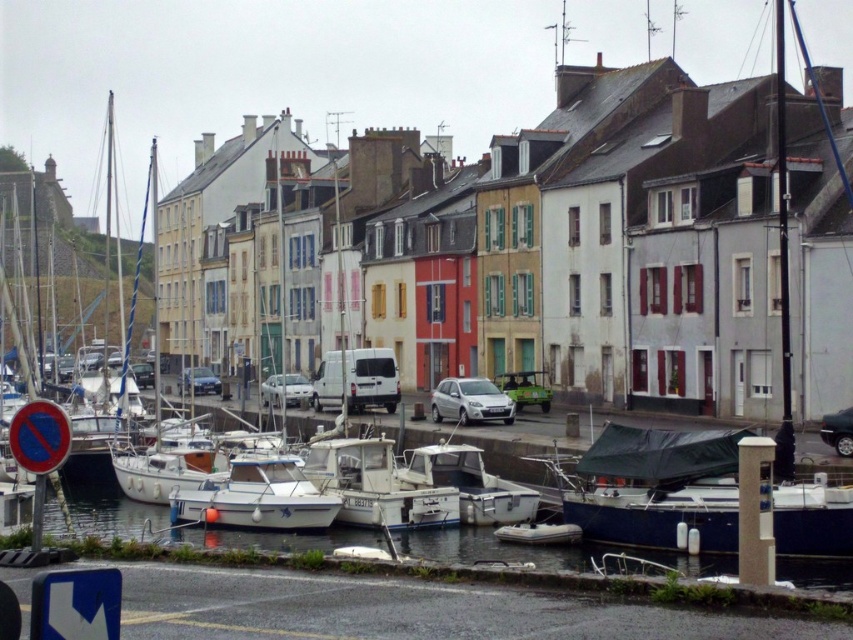
Question: Among these points, which one is farthest from the camera?

Choices:
 (A) (184, 378)
 (B) (447, 401)

Answer: (A)

Question: Which point appears closest to the camera in this image?

Choices:
 (A) (306, 390)
 (B) (618, 512)
 (C) (850, 433)

Answer: (B)

Question: Which object is positioned closest to the matte blue car at center?

Choices:
 (A) white plastic boat at center
 (B) shiny black sedan at center right

Answer: (A)

Question: Does dark blue tarpaulin-covered boat at center come behind white matte boat at center?

Choices:
 (A) yes
 (B) no

Answer: (B)

Question: Does dark blue tarpaulin-covered boat at center have a lesser width compared to white matte boat at center?

Choices:
 (A) no
 (B) yes

Answer: (A)

Question: Is white plastic boat at center thinner than shiny black sedan at center right?

Choices:
 (A) yes
 (B) no

Answer: (B)